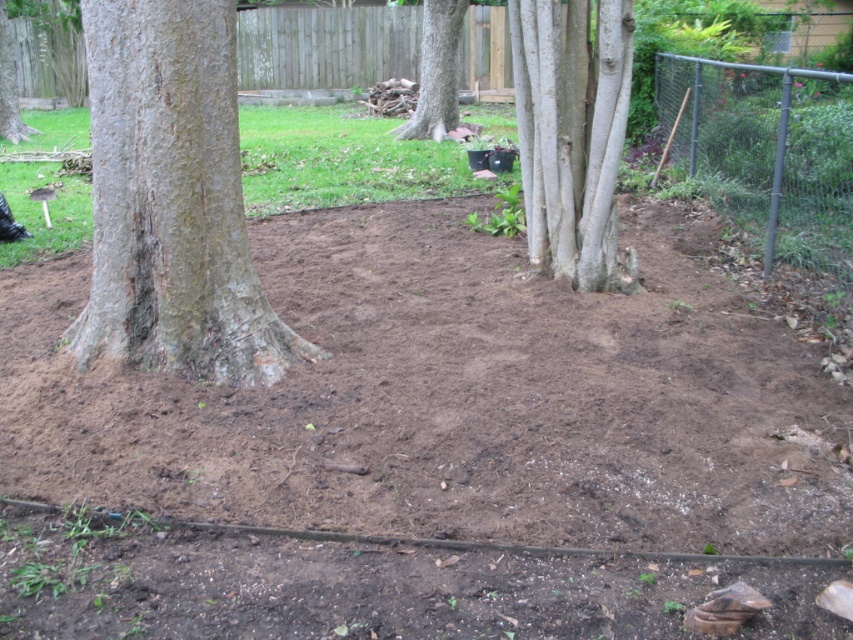
You are standing at the origin point of the image coordinate system. You want to walk to the brown soil at center. Which direction should you move in terms of x and y coordinates?

The brown soil at center is located at coordinates x 0.623 and y 0.530, so you should move in the positive x and positive y direction to reach it.

In the scene shown: You are standing in the backyard and want to walk from the brown soil at center to the smooth bark tree at left. Which direction should you move to get closer to the tree?

Since the brown soil at center is closer to the viewer than the smooth bark tree at left, you should move backward to get closer to the smooth bark tree at left.